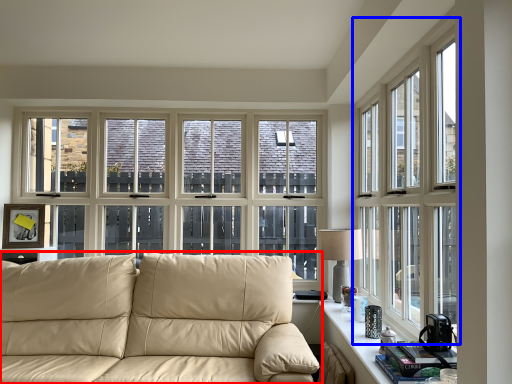
Question: Which point is further to the camera, studio couch (highlighted by a red box) or window (highlighted by a blue box)?

Choices:
 (A) studio couch
 (B) window

Answer: (A)